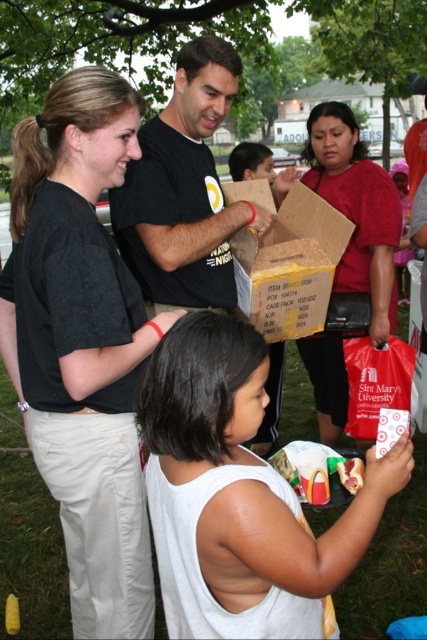
Can you confirm if white matte tank top at center is taller than matte red bag at center?

In fact, white matte tank top at center may be shorter than matte red bag at center.

Between white matte tank top at center and matte red bag at center, which one appears on the left side from the viewer's perspective?

From the viewer's perspective, white matte tank top at center appears more on the left side.

Describe the element at coordinates (237, 486) in the screenshot. I see `white matte tank top at center` at that location.

Locate an element on the screen. This screenshot has height=640, width=427. white matte tank top at center is located at coordinates (237, 486).

Can you confirm if matte red bag at center is positioned to the right of brown cardboard box at center?

Correct, you'll find matte red bag at center to the right of brown cardboard box at center.

Between matte red bag at center and brown cardboard box at center, which one is positioned higher?

brown cardboard box at center

Between point (312, 355) and point (307, 285), which one is positioned behind?

The point (312, 355) is behind.

Where is `matte red bag at center`? Image resolution: width=427 pixels, height=640 pixels. matte red bag at center is located at coordinates (350, 256).

Which is below, white matte tank top at center or matte black shirt at center?

white matte tank top at center is below.

Consider the image. Is white matte tank top at center positioned at the back of matte black shirt at center?

No, it is in front of matte black shirt at center.

Between point (322, 582) and point (196, 64), which one is positioned in front?

Point (322, 582) is more forward.

Where is `white matte tank top at center`? white matte tank top at center is located at coordinates 237,486.